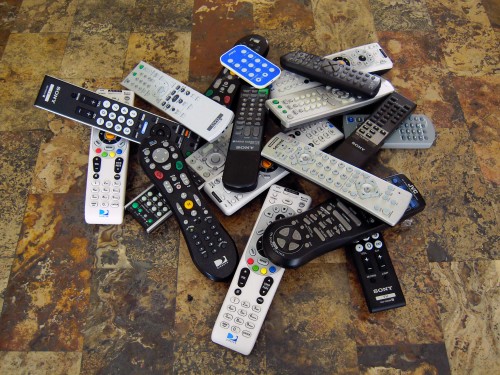
This screenshot has width=500, height=375. Find the location of `jvc remote`. jvc remote is located at coordinates (402, 177).